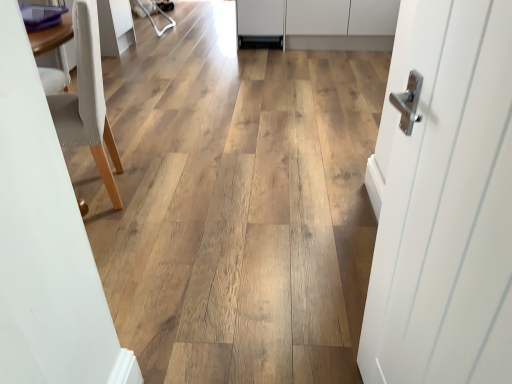
This screenshot has width=512, height=384. Describe the element at coordinates (444, 202) in the screenshot. I see `white smooth door at right` at that location.

Where is `light beige fabric chair at left`? The width and height of the screenshot is (512, 384). light beige fabric chair at left is located at coordinates (87, 100).

At what (x,y) coordinates should I click in order to perform the action: click on white smooth door at right. Please return your answer as a coordinate pair (x, y). This screenshot has width=512, height=384. Looking at the image, I should click on (444, 202).

Is white matte cabinet at upper center beside light beige fabric chair at left?

No.

Is white matte cabinet at upper center located outside light beige fabric chair at left?

Absolutely, white matte cabinet at upper center is external to light beige fabric chair at left.

Is white matte cabinet at upper center at the right side of light beige fabric chair at left?

Yes, white matte cabinet at upper center is to the right of light beige fabric chair at left.

Which object is more forward, white matte cabinet at upper center or light beige fabric chair at left?

Positioned in front is light beige fabric chair at left.

From the image's perspective, between white matte cabinet at upper center and white smooth door at right, which one is located above?

white matte cabinet at upper center is shown above in the image.

Which is less distant, (292, 15) or (438, 37)?

Positioned in front is point (438, 37).

How many degrees apart are the facing directions of white matte cabinet at upper center and white smooth door at right?

The angle between the facing direction of white matte cabinet at upper center and the facing direction of white smooth door at right is 79.7 degrees.

Is white matte cabinet at upper center surrounding white smooth door at right?

Actually, white smooth door at right is outside white matte cabinet at upper center.

Is light beige fabric chair at left taller than white matte cabinet at upper center?

Indeed, light beige fabric chair at left has a greater height compared to white matte cabinet at upper center.

Between light beige fabric chair at left and white matte cabinet at upper center, which one is positioned behind?

white matte cabinet at upper center.

How different are the orientations of light beige fabric chair at left and white matte cabinet at upper center in degrees?

72 degrees separate the facing orientations of light beige fabric chair at left and white matte cabinet at upper center.

Is light beige fabric chair at left oriented away from white matte cabinet at upper center?

No.

Based on the photo, considering the sizes of objects white smooth door at right and white matte cabinet at upper center in the image provided, who is wider, white smooth door at right or white matte cabinet at upper center?

With larger width is white matte cabinet at upper center.

Would you say white matte cabinet at upper center is part of white smooth door at right's contents?

No, white matte cabinet at upper center is not a part of white smooth door at right.

Is white smooth door at right directly adjacent to white matte cabinet at upper center?

No, white smooth door at right is not next to white matte cabinet at upper center.

Find the location of a particular element. This screenshot has height=384, width=512. cabinetry lying behind the white smooth door at right is located at coordinates tap(321, 23).

Is light beige fabric chair at left looking in the opposite direction of white smooth door at right?

No, light beige fabric chair at left's orientation is not away from white smooth door at right.

The width and height of the screenshot is (512, 384). I want to click on door that appears on the right of light beige fabric chair at left, so click(x=444, y=202).

Who is taller, light beige fabric chair at left or white smooth door at right?

With more height is white smooth door at right.

Can you confirm if white smooth door at right is bigger than light beige fabric chair at left?

Incorrect, white smooth door at right is not larger than light beige fabric chair at left.

Between white smooth door at right and light beige fabric chair at left, which one is positioned in front?

Positioned in front is white smooth door at right.

Is point (442, 171) closer or farther from the camera than point (81, 14)?

Clearly, point (442, 171) is closer to the camera than point (81, 14).

Where is `cabinetry below the light beige fabric chair at left (from a real-world perspective)`? The width and height of the screenshot is (512, 384). cabinetry below the light beige fabric chair at left (from a real-world perspective) is located at coordinates (321, 23).

Locate an element on the screen. The width and height of the screenshot is (512, 384). door on the left of white matte cabinet at upper center is located at coordinates (444, 202).

Which object lies nearer to the anchor point light beige fabric chair at left, white smooth door at right or white matte cabinet at upper center?

white smooth door at right lies closer to light beige fabric chair at left than the other object.

Looking at the image, which one is located closer to light beige fabric chair at left, white matte cabinet at upper center or white smooth door at right?

The object closer to light beige fabric chair at left is white smooth door at right.

Looking at the image, which one is located further to white matte cabinet at upper center, light beige fabric chair at left or white smooth door at right?

white smooth door at right lies further to white matte cabinet at upper center than the other object.

Consider the image. When comparing their distances from white smooth door at right, does light beige fabric chair at left or white matte cabinet at upper center seem further?

Based on the image, white matte cabinet at upper center appears to be further to white smooth door at right.

Considering their positions, is white matte cabinet at upper center positioned further to white smooth door at right than light beige fabric chair at left?

white matte cabinet at upper center is positioned further to the anchor white smooth door at right.

Based on their spatial positions, is white smooth door at right or light beige fabric chair at left further from white matte cabinet at upper center?

white smooth door at right is positioned further to the anchor white matte cabinet at upper center.

I want to click on chair located between white smooth door at right and white matte cabinet at upper center in the depth direction, so click(x=87, y=100).